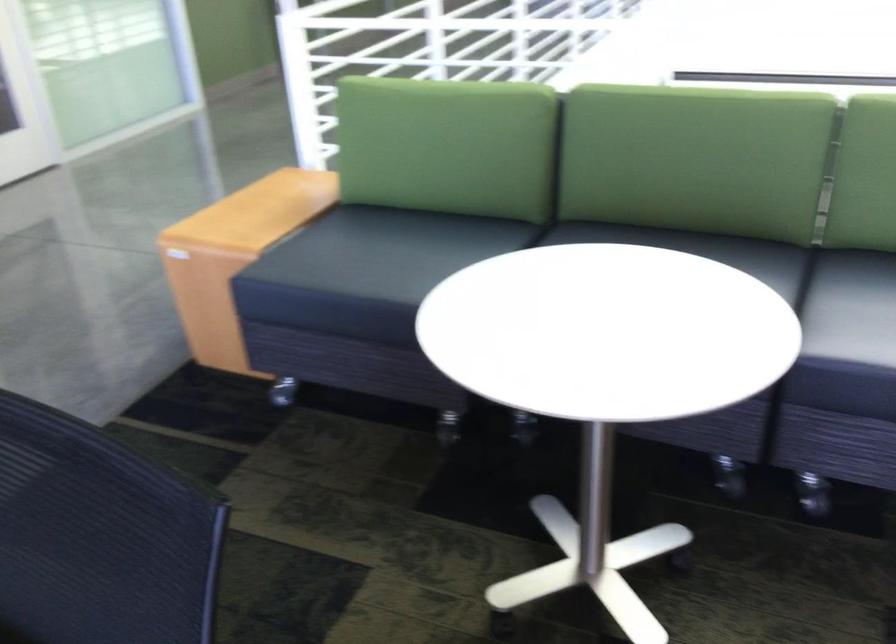
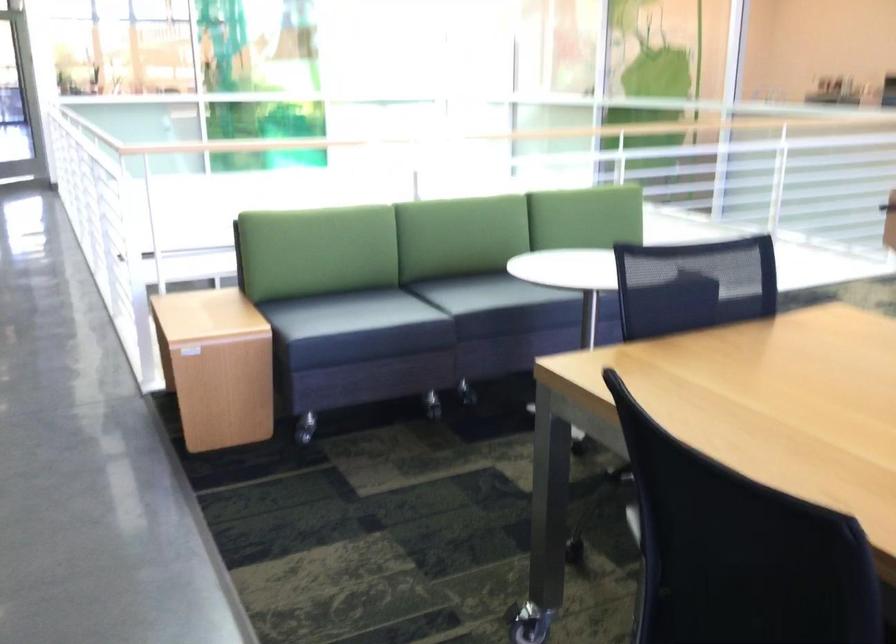
Find the pixel in the second image that matches point 538,460 in the first image.

(432, 404)